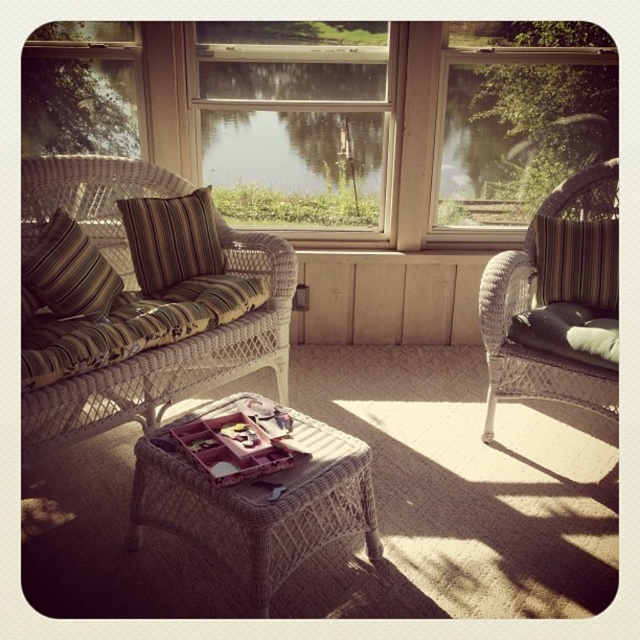
You are standing at the entrance of the porch and want to place a 5 feet long decorative bench. The bench needs to be placed in a straight line from where you are standing to the white wicker couch at left. Is there enough space for the bench along that path?

The distance between you and the white wicker couch at left is 4.89 feet. Since the bench is 5 feet long, there isn t enough space to place it along the straight path without overlapping.

You are sitting on the white wicker couch at left and want to look out through the clear glass window at center. Can you see through the window from your current position?

The white wicker couch at left is behind the clear glass window at center, so yes, you can see through the clear glass window at center from your position on the white wicker couch at left.

You are standing on the porch and want to reach a point that is exactly 7 feet away from you. Is the point at coordinates point (268, 243) within this range?

The distance of point (268, 243) from viewer is 7.35 feet, so it is slightly beyond the 7 feet range.